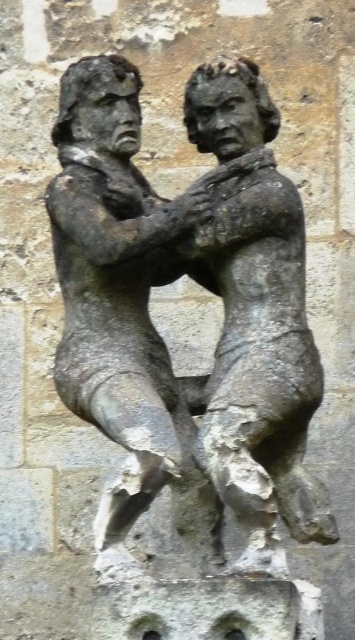
Question: Can you confirm if stone statue of man at center is smaller than bronze statue at center?

Choices:
 (A) yes
 (B) no

Answer: (B)

Question: Which point is farther from the camera taking this photo?

Choices:
 (A) (270, 508)
 (B) (153, 483)

Answer: (A)

Question: Which object is farther from the camera taking this photo?

Choices:
 (A) bronze statue at center
 (B) stone statue of man at center

Answer: (B)

Question: Does stone statue of man at center come behind bronze statue at center?

Choices:
 (A) yes
 (B) no

Answer: (A)

Question: Is stone statue of man at center positioned at the back of bronze statue at center?

Choices:
 (A) yes
 (B) no

Answer: (A)